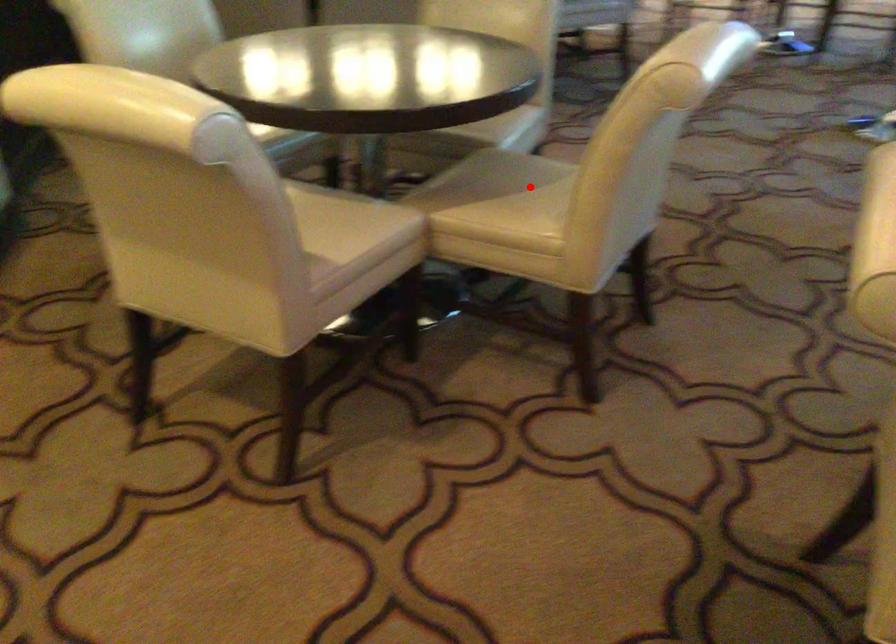
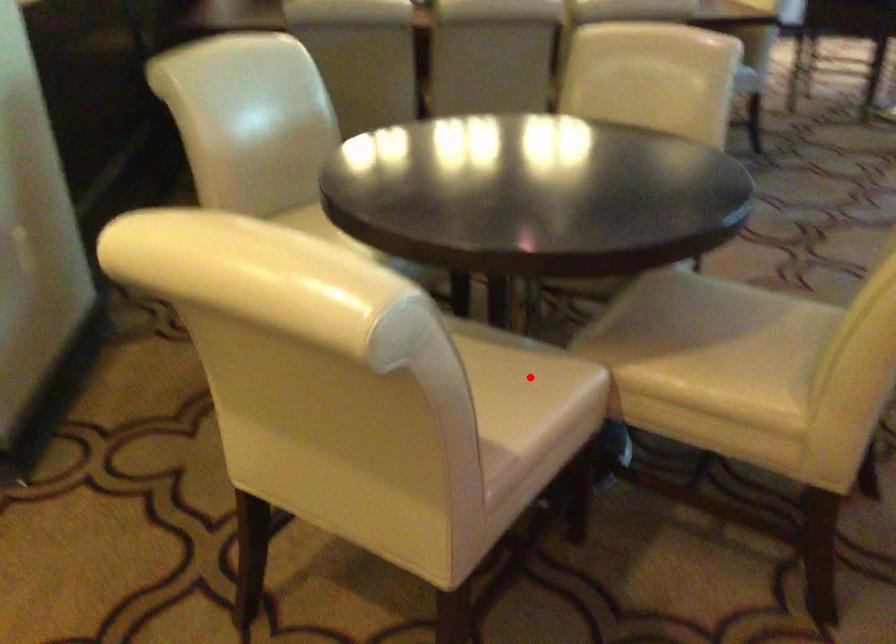
I am providing you with two images of the same scene from different viewpoints. A red point is marked on the first image and another point is marked on the second image. Is the marked point in image1 the same physical position as the marked point in image2?

No